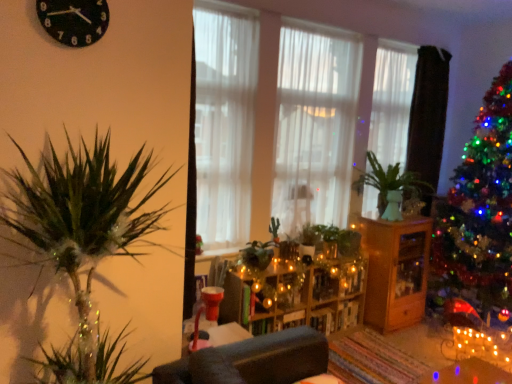
Question: Is white sheer curtain at center, the second curtain viewed from the right, to the right of wooden shelves at center from the viewer's perspective?

Choices:
 (A) no
 (B) yes

Answer: (B)

Question: From a real-world perspective, is white sheer curtain at center, the second curtain viewed from the right, physically above wooden shelves at center?

Choices:
 (A) yes
 (B) no

Answer: (A)

Question: Is white sheer curtain at center, which ranks as the second curtain in left-to-right order, aimed at wooden shelves at center?

Choices:
 (A) yes
 (B) no

Answer: (B)

Question: Can we say white sheer curtain at center, which ranks as the second curtain in left-to-right order, lies outside wooden shelves at center?

Choices:
 (A) yes
 (B) no

Answer: (A)

Question: Is white sheer curtain at center, which ranks as the second curtain in left-to-right order, taller than wooden shelves at center?

Choices:
 (A) yes
 (B) no

Answer: (A)

Question: Is white sheer curtain at center, which ranks as the second curtain in left-to-right order, to the left of wooden shelves at center from the viewer's perspective?

Choices:
 (A) yes
 (B) no

Answer: (B)

Question: Does white sheer curtain at center, which is the third curtain from left to right, contain transparent glass vase at center-right?

Choices:
 (A) no
 (B) yes

Answer: (A)

Question: Is white sheer curtain at center, which is the third curtain from left to right, closer to camera compared to transparent glass vase at center-right?

Choices:
 (A) no
 (B) yes

Answer: (A)

Question: From a real-world perspective, is white sheer curtain at center, which is the third curtain from left to right, positioned under transparent glass vase at center-right based on gravity?

Choices:
 (A) yes
 (B) no

Answer: (B)

Question: Does white sheer curtain at center, the first curtain viewed from the right, appear on the right side of transparent glass vase at center-right?

Choices:
 (A) no
 (B) yes

Answer: (B)

Question: From a real-world perspective, is white sheer curtain at center, which is the third curtain from left to right, located higher than transparent glass vase at center-right?

Choices:
 (A) yes
 (B) no

Answer: (A)

Question: Is white sheer curtain at center, which is the third curtain from left to right, not close to transparent glass vase at center-right?

Choices:
 (A) no
 (B) yes

Answer: (A)

Question: Considering the relative sizes of wooden cabinet at center and transparent glass vase at center-right in the image provided, is wooden cabinet at center thinner than transparent glass vase at center-right?

Choices:
 (A) yes
 (B) no

Answer: (B)